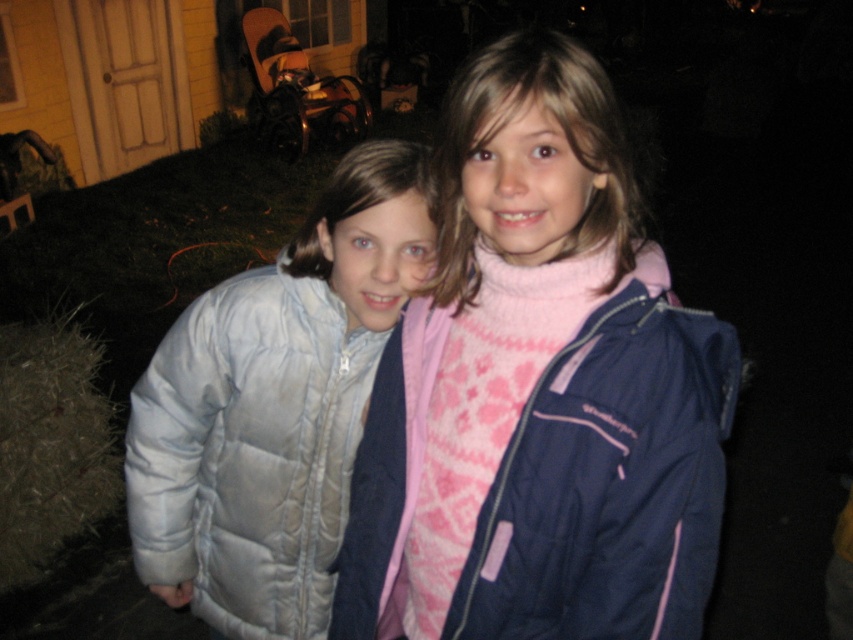
Does pink quilted jacket at center have a greater width compared to light gray quilted jacket at left?

Indeed, pink quilted jacket at center has a greater width compared to light gray quilted jacket at left.

Is point (608, 372) farther from camera compared to point (338, 467)?

That is False.

This screenshot has width=853, height=640. What are the coordinates of `pink quilted jacket at center` in the screenshot? It's located at (540, 390).